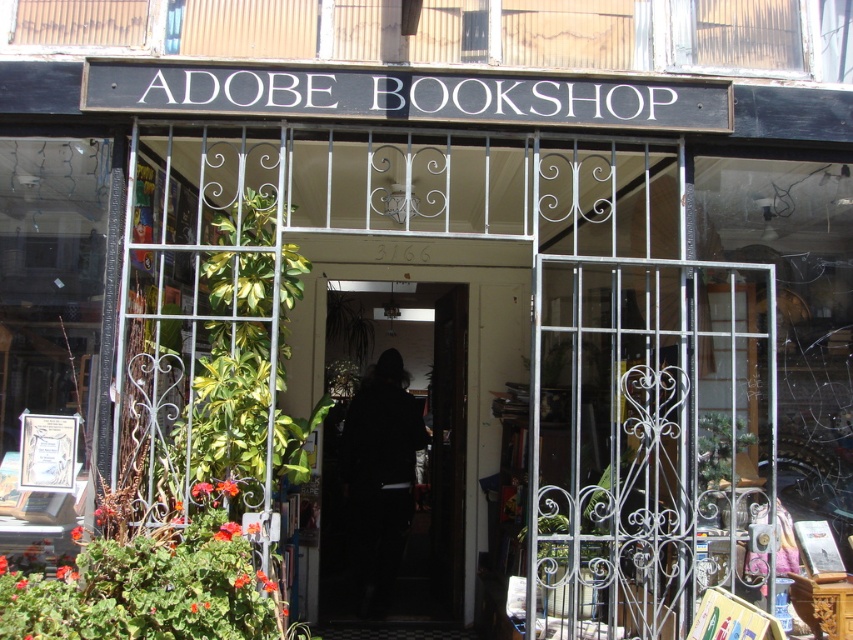
Between metallic wrought iron gate at center and black fabric door at center, which one has more height?

With more height is black fabric door at center.

Is point (579, 538) farther from camera compared to point (395, 481)?

No.

Identify the location of metallic wrought iron gate at center. (647, 442).